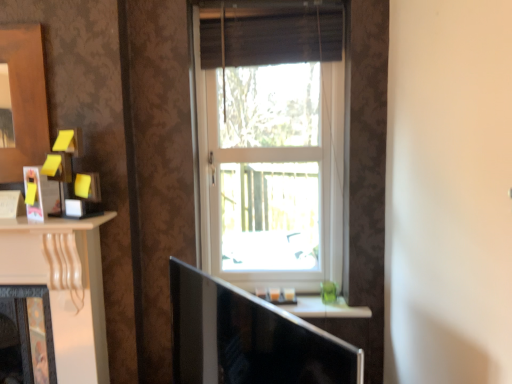
Question: From a real-world perspective, is white plastic window at center positioned above or below white glossy window sill at center?

Choices:
 (A) below
 (B) above

Answer: (B)

Question: From the image's perspective, is white plastic window at center located above or below white glossy window sill at center?

Choices:
 (A) below
 (B) above

Answer: (B)

Question: Based on their relative distances, which object is farther from the matte black tv at center?

Choices:
 (A) matte black picture frame at left
 (B) brown fabric curtain at upper center
 (C) matte black fireplace at left
 (D) white plastic window at center
 (E) white glossy window sill at center

Answer: (B)

Question: Based on their relative distances, which object is farther from the white glossy window sill at center?

Choices:
 (A) white plastic window at center
 (B) matte black picture frame at left
 (C) matte black tv at center
 (D) matte black fireplace at left
 (E) brown fabric curtain at upper center

Answer: (B)